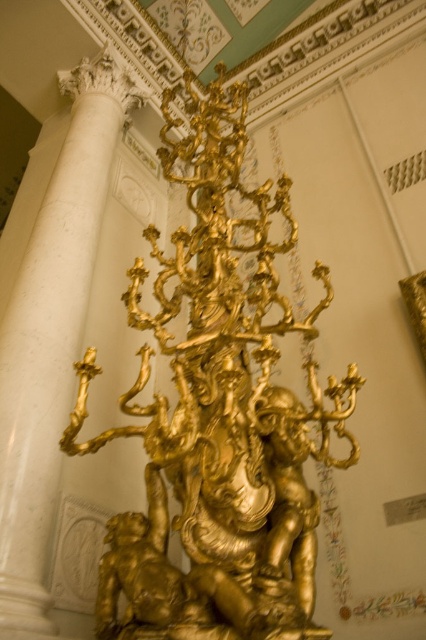
You are an interior designer assessing the proportions of a grand hall. You observe the gold polished statue at center and the white marble column at left. Which object has a greater height?

The white marble column at left is taller than the gold polished statue at center, so the white marble column at left has a greater height.

You are an interior designer planning to move a large sofa that is 4 meters long into the space between the gold polished statue at center and the white marble column at left. Based on the scene, can the sofa fit in that space?

The gold polished statue at center is 4.45 meters from the white marble column at left. Since the sofa is 4 meters long, it will fit in the space between them as the distance is slightly larger than the sofa.

You are an interior designer planning to place a new sofa in the room with the gold polished statue at center and the white marble column at left. The sofa will be placed between them. Based on their sizes, which object will the sofa be closer to?

The gold polished statue at center has a smaller size compared to the white marble column at left, so the sofa will need to be closer to the gold polished statue at center to maintain balance between the two objects.